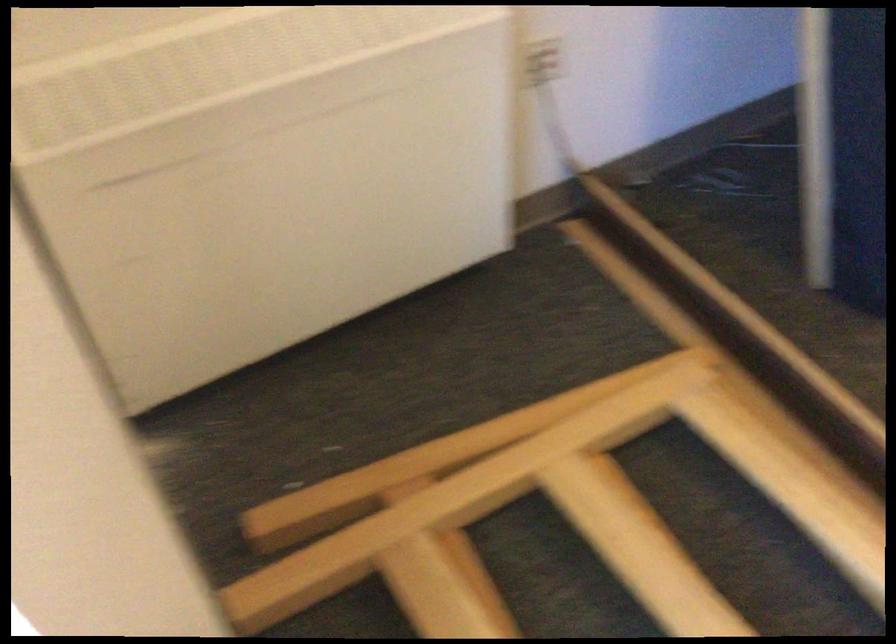
Describe the element at coordinates (543, 62) in the screenshot. The width and height of the screenshot is (896, 644). I see `the power outlet` at that location.